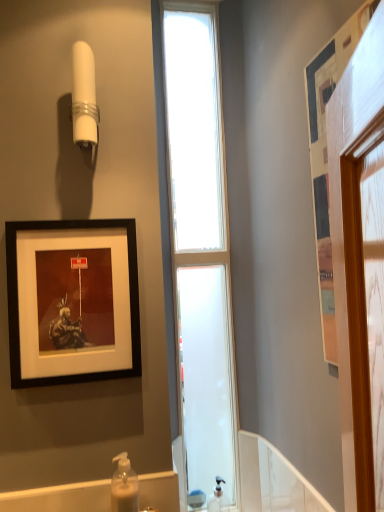
Question: Is clear glass window at center wider or thinner than white plastic shower at upper left?

Choices:
 (A) thin
 (B) wide

Answer: (A)

Question: Considering the positions of clear glass window at center and white plastic shower at upper left in the image, is clear glass window at center taller or shorter than white plastic shower at upper left?

Choices:
 (A) tall
 (B) short

Answer: (A)

Question: Based on their relative distances, which object is nearer to the black matte picture frame at upper left, which ranks as the 2th picture frame in front-to-back order?

Choices:
 (A) wooden framed picture at right, the first picture frame positioned from the right
 (B) clear glass window at center
 (C) white plastic shower at upper left
 (D) translucent plastic soap dispenser at lower center, arranged as the 2th soap dispenser when viewed from the back
 (E) clear plastic soap dispenser at lower center, positioned as the second soap dispenser in front-to-back order

Answer: (C)

Question: Considering the real-world distances, which object is closest to the clear glass window at center?

Choices:
 (A) white plastic shower at upper left
 (B) translucent plastic soap dispenser at lower center, the 2th soap dispenser in the right-to-left sequence
 (C) black matte picture frame at upper left, marked as the 1th picture frame in a left-to-right arrangement
 (D) clear plastic soap dispenser at lower center, positioned as the second soap dispenser in front-to-back order
 (E) wooden framed picture at right, the 1th picture frame from the front

Answer: (C)